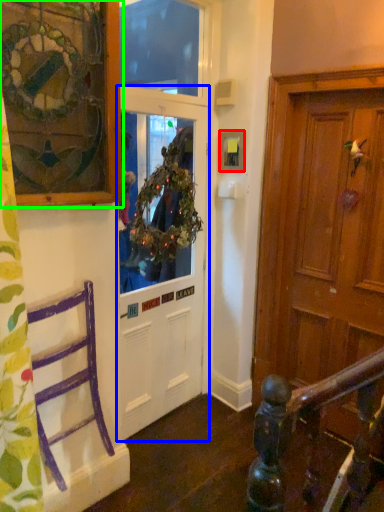
Question: Considering the real-world distances, which object is closest to picture frame (highlighted by a red box)? door (highlighted by a blue box) or picture frame (highlighted by a green box).

Choices:
 (A) door
 (B) picture frame

Answer: (A)